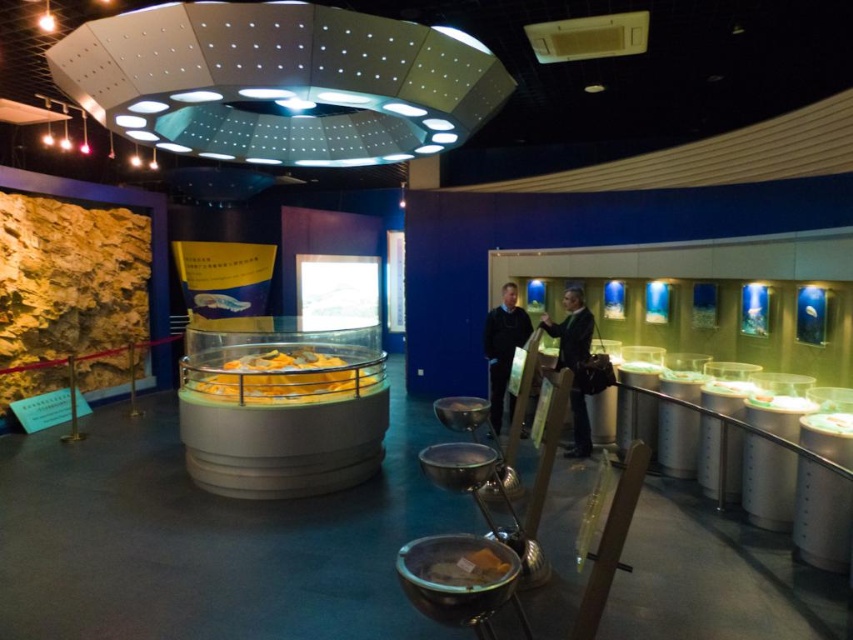
Question: Can you confirm if black leather jacket at center is positioned below dark blue sweater at center?

Choices:
 (A) no
 (B) yes

Answer: (A)

Question: Which object is closer to the camera taking this photo?

Choices:
 (A) black leather jacket at center
 (B) dark blue sweater at center

Answer: (A)

Question: Among these objects, which one is nearest to the camera?

Choices:
 (A) dark blue sweater at center
 (B) black leather jacket at center

Answer: (B)

Question: Is the position of black leather jacket at center less distant than that of dark blue sweater at center?

Choices:
 (A) no
 (B) yes

Answer: (B)

Question: Is the position of black leather jacket at center more distant than that of dark blue sweater at center?

Choices:
 (A) no
 (B) yes

Answer: (A)

Question: Which object is closer to the camera taking this photo?

Choices:
 (A) black leather jacket at center
 (B) dark blue sweater at center

Answer: (A)